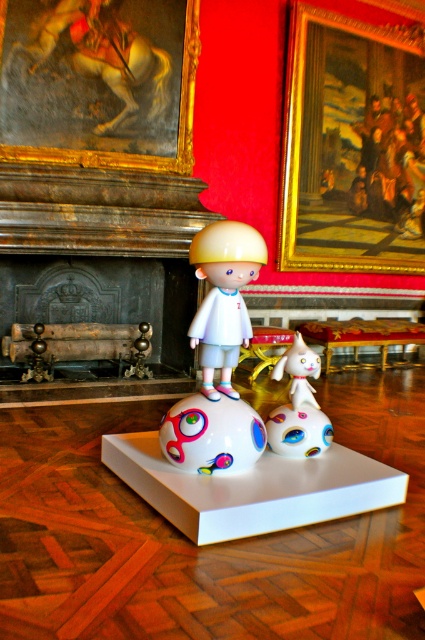
From the picture: Measure the distance between multicolored glossy ball at center and white glossy cat at center.

multicolored glossy ball at center is 6.63 inches away from white glossy cat at center.

Is the position of multicolored glossy ball at center more distant than that of white glossy cat at center?

Yes, multicolored glossy ball at center is behind white glossy cat at center.

Does point (289, 420) lie behind point (285, 365)?

No.

The image size is (425, 640). In order to click on multicolored glossy ball at center in this screenshot , I will do `click(297, 429)`.

Does point (206, 404) come in front of point (291, 433)?

Yes, it is.

Does matte white ball at center have a lesser height compared to multicolored glossy ball at center?

No, matte white ball at center is not shorter than multicolored glossy ball at center.

Is point (192, 467) positioned before point (277, 445)?

Yes, it is.

The image size is (425, 640). Identify the location of matte white ball at center. (212, 435).

Is matte white doll at center to the right of white glossy cat at center from the viewer's perspective?

Incorrect, matte white doll at center is not on the right side of white glossy cat at center.

Is point (224, 320) less distant than point (300, 397)?

That is True.

Describe the element at coordinates (223, 298) in the screenshot. I see `matte white doll at center` at that location.

This screenshot has height=640, width=425. Identify the location of matte white doll at center. (223, 298).